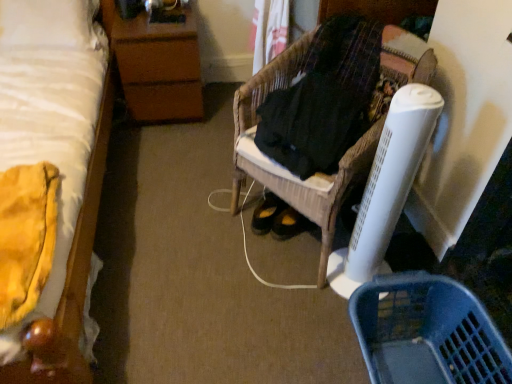
This screenshot has width=512, height=384. I want to click on woven wood chair at center, so click(x=345, y=82).

Does woven wood chair at center appear on the right side of blue plastic basket at lower right?

Incorrect, woven wood chair at center is not on the right side of blue plastic basket at lower right.

How different are the orientations of woven wood chair at center and blue plastic basket at lower right in degrees?

The facing directions of woven wood chair at center and blue plastic basket at lower right are 33.5 degrees apart.

Is woven wood chair at center next to blue plastic basket at lower right?

They are not placed beside each other.

The image size is (512, 384). I want to click on furniture located behind the blue plastic basket at lower right, so click(345, 82).

Which of these two, black woven fabric at center or blue plastic basket at lower right, is wider?

Wider between the two is blue plastic basket at lower right.

I want to click on basket below the black woven fabric at center (from a real-world perspective), so click(426, 332).

From a real-world perspective, between black woven fabric at center and blue plastic basket at lower right, who is vertically higher?

black woven fabric at center is physically above.

How distant is black woven fabric at center from blue plastic basket at lower right?

black woven fabric at center is 24.55 inches from blue plastic basket at lower right.

From the picture: Does woven wood chair at center come in front of brown wood nightstand at upper left?

Yes.

From a real-world perspective, which object rests below the other?

brown wood nightstand at upper left.

Consider the image. From their relative heights in the image, would you say woven wood chair at center is taller or shorter than brown wood nightstand at upper left?

Clearly, woven wood chair at center is taller compared to brown wood nightstand at upper left.

Would you consider woven wood chair at center to be distant from brown wood nightstand at upper left?

No, woven wood chair at center is in close proximity to brown wood nightstand at upper left.

In the image, is black woven fabric at center positioned in front of or behind brown wood nightstand at upper left?

In the image, black woven fabric at center appears in front of brown wood nightstand at upper left.

Is point (362, 97) closer to camera compared to point (196, 62)?

That is True.

From a real-world perspective, relative to brown wood nightstand at upper left, is black woven fabric at center vertically above or below?

In terms of real-world spatial position, black woven fabric at center is above brown wood nightstand at upper left.

Consider the image. Is brown wood nightstand at upper left inside black woven fabric at center?

No, brown wood nightstand at upper left is not inside black woven fabric at center.

Could you tell me if brown wood nightstand at upper left is facing white soft bed at left?

No.

Which of these two, brown wood nightstand at upper left or white soft bed at left, stands taller?

white soft bed at left.

Can you confirm if brown wood nightstand at upper left is bigger than white soft bed at left?

No, brown wood nightstand at upper left is not bigger than white soft bed at left.

How far apart are brown wood nightstand at upper left and white soft bed at left?

45.88 centimeters.

Consider the image. Which is in front, blue plastic basket at lower right or woven wood chair at center?

blue plastic basket at lower right is more forward.

Does blue plastic basket at lower right turn towards woven wood chair at center?

No, blue plastic basket at lower right is not oriented towards woven wood chair at center.

At what (x,y) coordinates should I click in order to perform the action: click on furniture above the blue plastic basket at lower right (from a real-world perspective). Please return your answer as a coordinate pair (x, y). The width and height of the screenshot is (512, 384). Looking at the image, I should click on (345, 82).

Is blue plastic basket at lower right next to woven wood chair at center?

No, blue plastic basket at lower right is not in contact with woven wood chair at center.

From a real-world perspective, is woven wood chair at center located higher than white soft bed at left?

Incorrect, from a real-world perspective, woven wood chair at center is lower than white soft bed at left.

Between woven wood chair at center and white soft bed at left, which one has less height?

woven wood chair at center.

You are a GUI agent. You are given a task and a screenshot of the screen. Output one action in this format:
    pyautogui.click(x=<x>, y=<y>)
    Task: Click on the furniture that is on the right side of white soft bed at left
    The height and width of the screenshot is (384, 512).
    Given the screenshot: What is the action you would take?
    pyautogui.click(x=345, y=82)

Is woven wood chair at center smaller than white soft bed at left?

Indeed, woven wood chair at center has a smaller size compared to white soft bed at left.

The image size is (512, 384). Identify the location of furniture located behind the blue plastic basket at lower right. (345, 82).

Where is `basket that is below the black woven fabric at center (from the image's perspective)`? basket that is below the black woven fabric at center (from the image's perspective) is located at coordinates (426, 332).

From the image, which object appears to be farther from white soft bed at left, brown wood nightstand at upper left or woven wood chair at center?

woven wood chair at center is positioned further to the anchor white soft bed at left.

Considering their positions, is blue plastic basket at lower right positioned closer to white soft bed at left than brown wood nightstand at upper left?

Based on the image, brown wood nightstand at upper left appears to be nearer to white soft bed at left.

Based on their spatial positions, is woven wood chair at center or white soft bed at left further from blue plastic basket at lower right?

white soft bed at left is positioned further to the anchor blue plastic basket at lower right.

Looking at the image, which one is located further to blue plastic basket at lower right, white soft bed at left or woven wood chair at center?

white soft bed at left is further to blue plastic basket at lower right.

Looking at the image, which one is located further to woven wood chair at center, brown wood nightstand at upper left or blue plastic basket at lower right?

The object further to woven wood chair at center is brown wood nightstand at upper left.

Which object lies nearer to the anchor point white soft bed at left, black woven fabric at center or blue plastic basket at lower right?

black woven fabric at center lies closer to white soft bed at left than the other object.

Considering their positions, is white soft bed at left positioned further to woven wood chair at center than blue plastic basket at lower right?

white soft bed at left is further to woven wood chair at center.

Estimate the real-world distances between objects in this image. Which object is further from black woven fabric at center, woven wood chair at center or brown wood nightstand at upper left?

brown wood nightstand at upper left lies further to black woven fabric at center than the other object.

The width and height of the screenshot is (512, 384). What are the coordinates of `basket positioned between white soft bed at left and brown wood nightstand at upper left from near to far` in the screenshot? It's located at (426, 332).

Identify the location of clothing located between white soft bed at left and brown wood nightstand at upper left in the depth direction. (323, 99).

At what (x,y) coordinates should I click in order to perform the action: click on furniture located between white soft bed at left and brown wood nightstand at upper left in the depth direction. Please return your answer as a coordinate pair (x, y). Looking at the image, I should click on (345, 82).

Identify the location of clothing between woven wood chair at center and brown wood nightstand at upper left in the front-back direction. This screenshot has height=384, width=512. (323, 99).